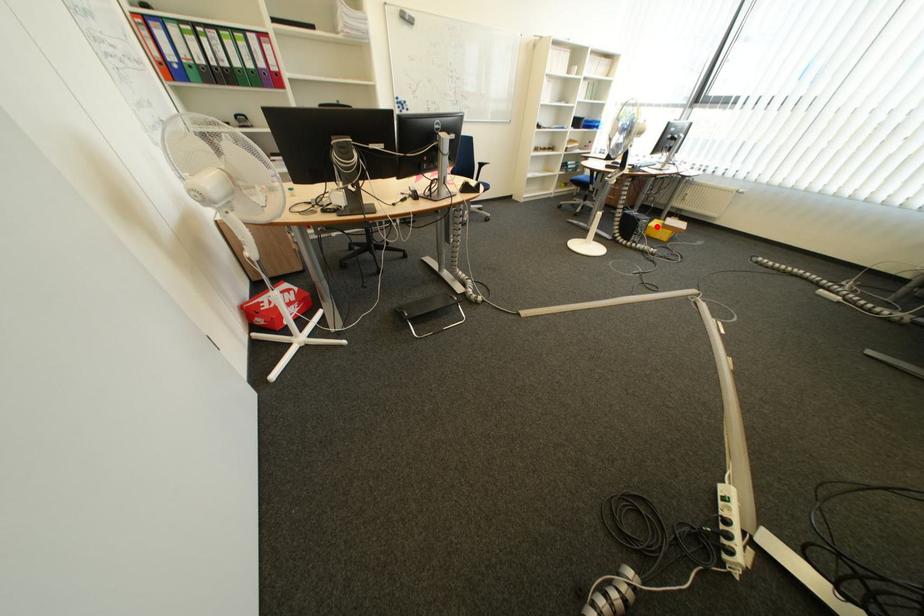
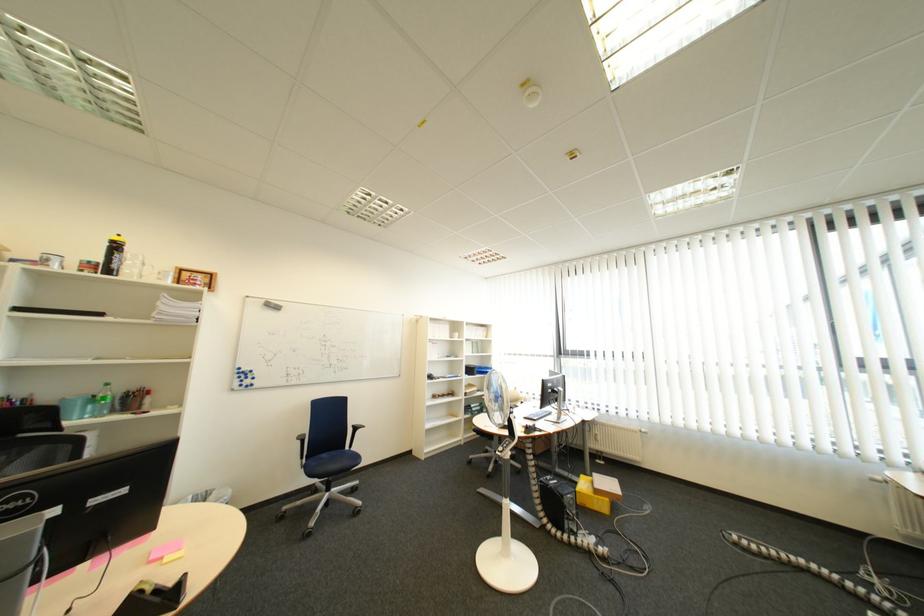
The point at the highlighted location is marked in the first image. Where is the corresponding point in the second image?

(585, 503)